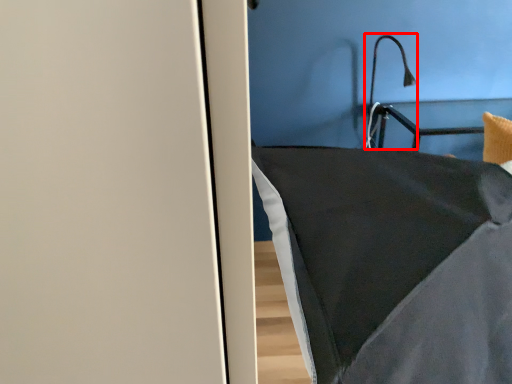
Question: In this image, where is light fixture (annotated by the red box) located relative to furniture?

Choices:
 (A) right
 (B) left

Answer: (A)